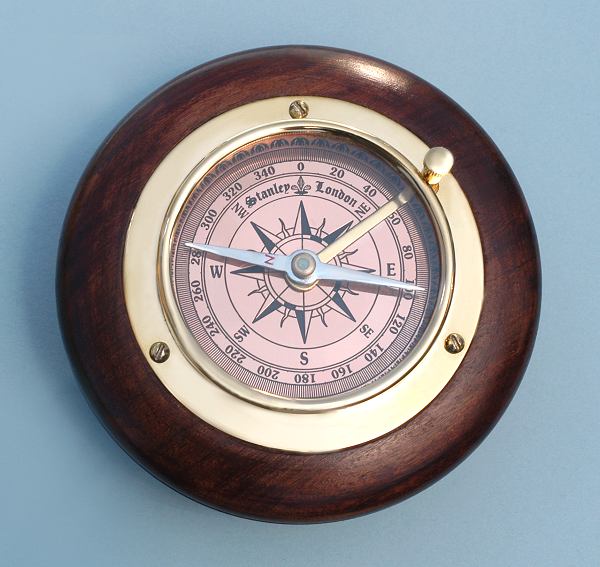
I want to click on dark polished wood, so click(495, 350).